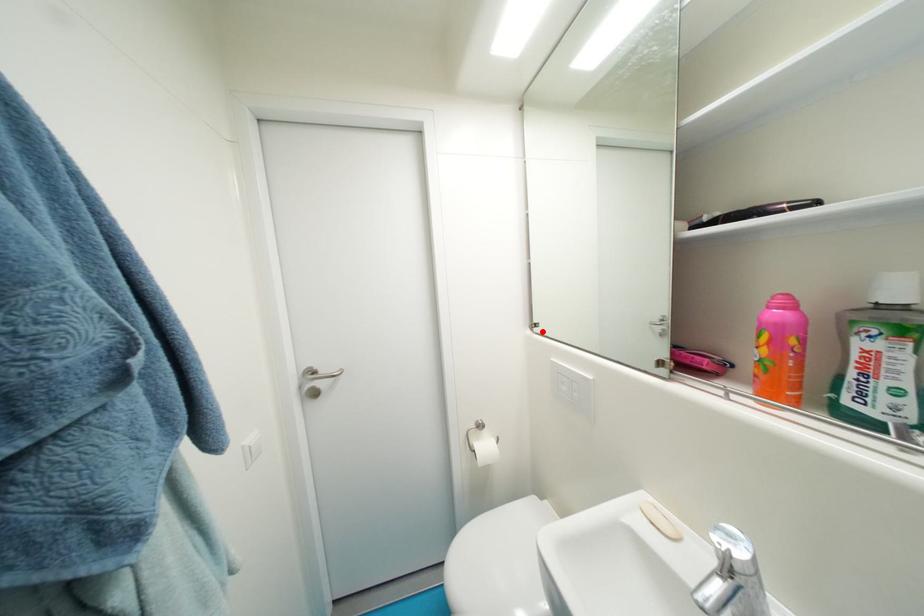
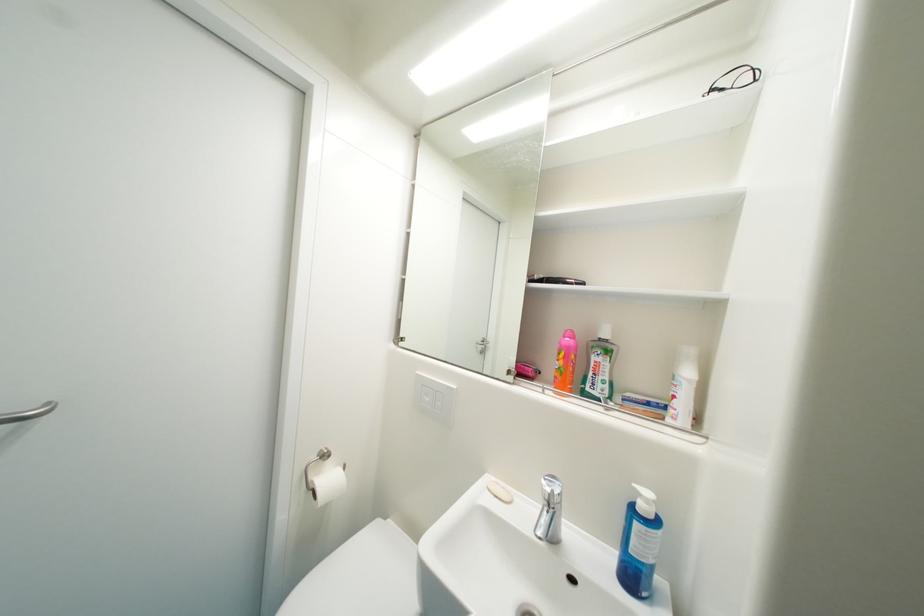
The point at the highlighted location is marked in the first image. Where is the corresponding point in the second image?

(407, 345)